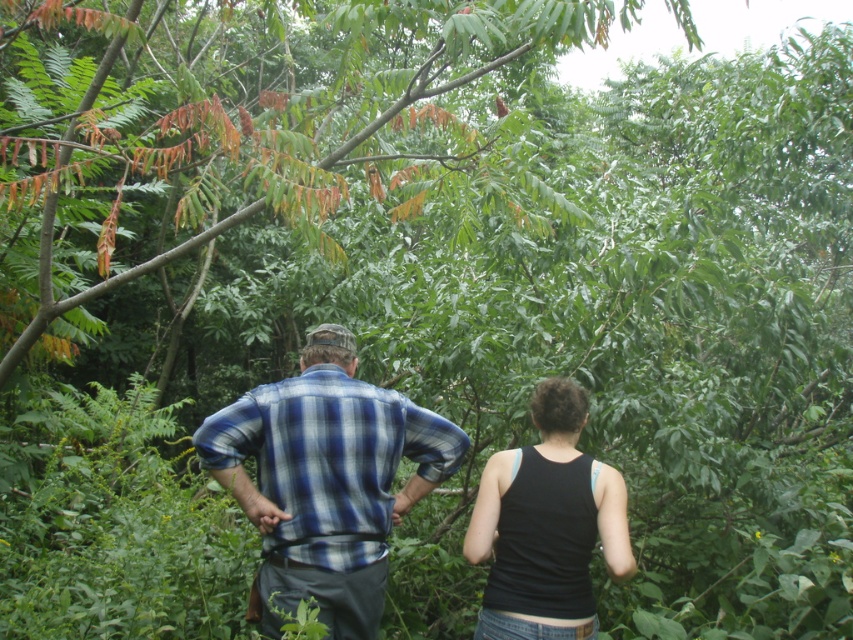
You are a photographer trying to capture a portrait of both the blue plaid shirt at center and the black fabric tank top at center. Since they are positioned side by side, which one should you focus on first to ensure their faces are visible in the frame?

The blue plaid shirt at center is to the left of the black fabric tank top at center, so you should focus on the blue plaid shirt at center first to ensure their faces are visible in the frame.

You are a photographer trying to capture a closeup of the blue plaid shirt at center. You have a camera with a zoom lens that can focus on a specific point. The point you want to focus on is point (325,481). Is this point on the blue plaid shirt at center?

Yes, the point (325,481) is on the blue plaid shirt at center, so the camera can focus on that point to capture the closeup.